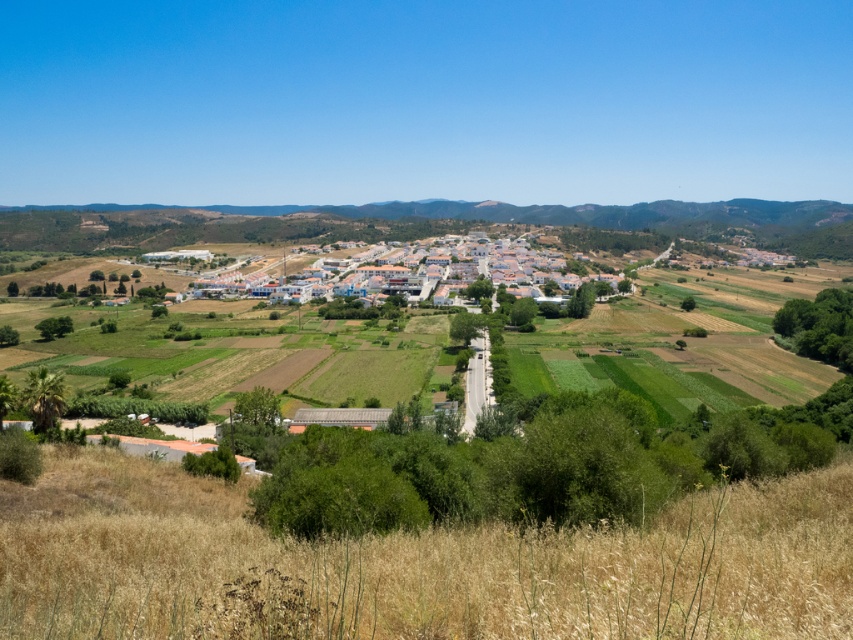
You are a drone operator trying to capture aerial footage of the dry grass at lower center and the white matte buildings at center. Which object appears larger in the camera frame?

The white matte buildings at center appear larger in the camera frame because they are bigger than the dry grass at lower center.

You are standing at the center of the image and want to walk towards the dry grass at lower center. Which direction should you face to walk directly towards it?

The dry grass at lower center is located at point (415, 564) in 2D coordinates, so you should face towards the lower center direction to walk directly towards it.